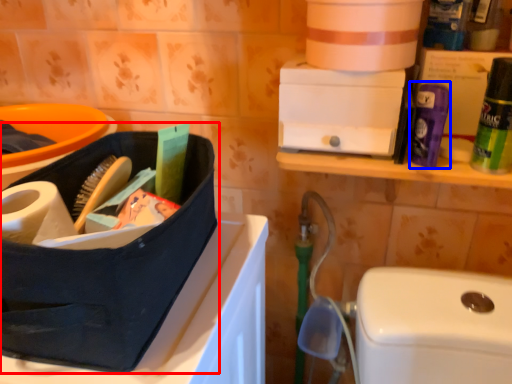
Question: Which object appears closest to the camera in this image, lunch box (highlighted by a red box) or cleaning product (highlighted by a blue box)?

Choices:
 (A) lunch box
 (B) cleaning product

Answer: (A)